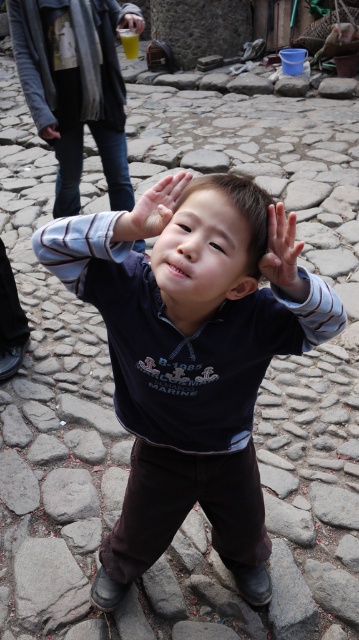
Question: Does gray rough stone at lower center appear on the left side of white matte hand at center?

Choices:
 (A) no
 (B) yes

Answer: (B)

Question: Which point is closer to the camera taking this photo?

Choices:
 (A) (63, 509)
 (B) (132, 29)
 (C) (178, 225)
 (D) (152, 196)

Answer: (D)

Question: Which point is closer to the camera taking this photo?

Choices:
 (A) (168, 192)
 (B) (19, 579)

Answer: (A)

Question: Is the position of dark blue fleece at center less distant than that of dark gray leather hand at center?

Choices:
 (A) no
 (B) yes

Answer: (B)

Question: Which of these objects is positioned closest to the gray woolen sweater at upper left?

Choices:
 (A) black matte eye at center
 (B) dark gray leather hand at center

Answer: (B)

Question: Is dark blue fleece at center in front of dark gray leather hand at center?

Choices:
 (A) no
 (B) yes

Answer: (B)